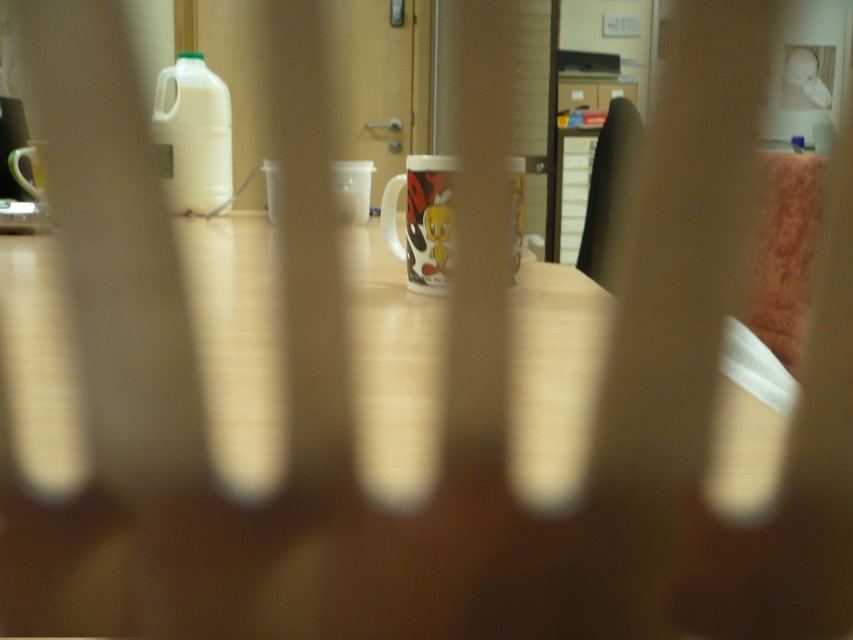
You are sitting in the brown leather chair at right and want to reach the matte white mug at left on the table. Can you easily grab it without moving from your seat?

The brown leather chair at right is further to the viewer than the matte white mug at left, meaning the mug is closer to you. Since the mug is nearer, you can easily reach it without moving from your seat.

You are trying to place the glossy ceramic mug at center on the brown leather chair at right. Based on their sizes, will the mug fit on the chair without falling off?

The glossy ceramic mug at center is narrower than the brown leather chair at right, so it should fit without falling off.

You are trying to decide whether to place a new plant pot between the glossy ceramic mug at center and the brown leather chair at right. Considering their heights, which object should the plant pot be placed closer to?

The glossy ceramic mug at center is shorter than the brown leather chair at right. Therefore, the plant pot should be placed closer to the glossy ceramic mug at center to ensure it doesn